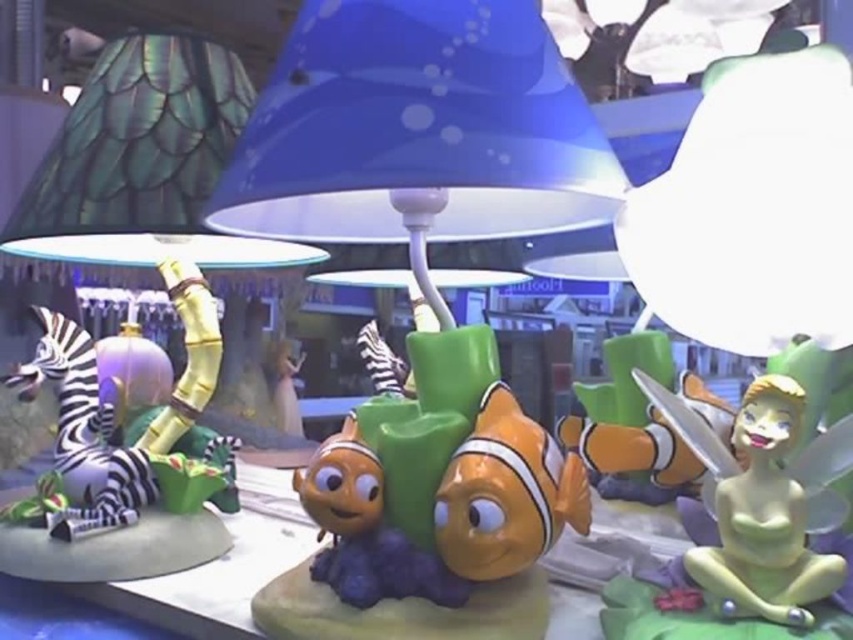
Question: Does green rubber tinker bell at lower right appear under orange matte clownfish at center?

Choices:
 (A) yes
 (B) no

Answer: (B)

Question: Is orange matte clownfish at center positioned in front of shiny orange fish at center?

Choices:
 (A) yes
 (B) no

Answer: (A)

Question: Among these objects, which one is nearest to the camera?

Choices:
 (A) shiny orange fish at center
 (B) green rubber tinker bell at lower right
 (C) orange matte clownfish at center

Answer: (B)

Question: Which of the following is the closest to the observer?

Choices:
 (A) shiny orange fish at center
 (B) orange matte clownfish at center

Answer: (B)

Question: Among these points, which one is farthest from the camera?

Choices:
 (A) (373, 520)
 (B) (585, 497)

Answer: (A)

Question: Can you confirm if green rubber tinker bell at lower right is positioned to the left of orange matte clownfish at center?

Choices:
 (A) yes
 (B) no

Answer: (B)